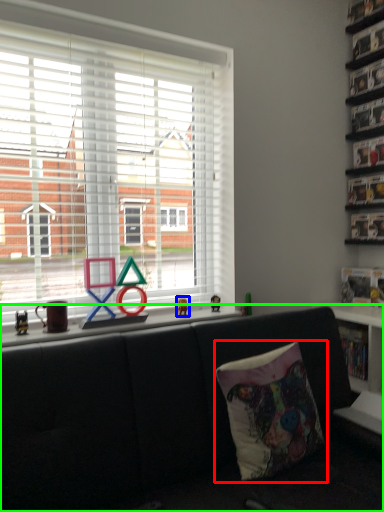
Question: Which object is positioned closest to pillow (highlighted by a red box)? Select from miniature (highlighted by a blue box) and studio couch (highlighted by a green box).

Choices:
 (A) miniature
 (B) studio couch

Answer: (B)